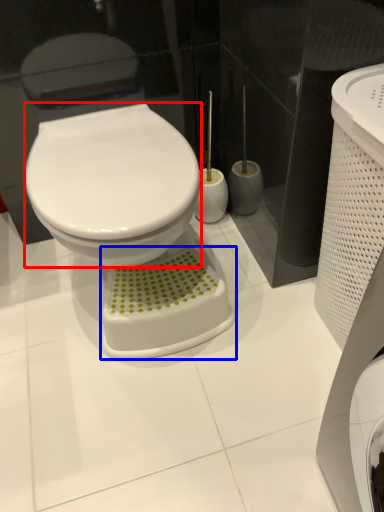
Question: Among these objects, which one is farthest to the camera, bidet (highlighted by a red box) or porcelain (highlighted by a blue box)?

Choices:
 (A) bidet
 (B) porcelain

Answer: (B)